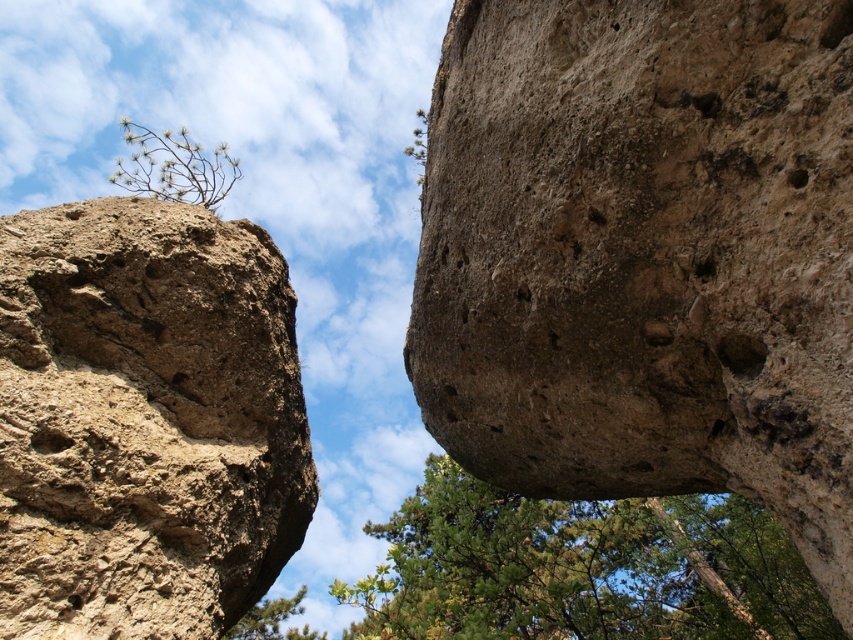
You are standing at the camera position and want to take a photo of the green leafy tree at upper left. The camera has a maximum focus range of 5 meters. Will the tree be in focus?

The green leafy tree at upper left is 5.84 meters away from camera, which exceeds the camera maximum focus range of 5 meters. Therefore, the tree will not be in focus.

Consider the image. You are standing in the natural scene and want to place a small flag at the highest point between the brown rough rock at upper left and the green leafy tree at center. Which object should you choose?

The brown rough rock at upper left is located above the green leafy tree at center, so you should place the flag on the brown rough rock at upper left as it is higher.

You are standing in the natural scene and want to take a photo of both the green leafy tree at upper left and the green leafy tree at lower left. Which tree should you position yourself to the right of to include both in your shot?

You should position yourself to the right of the green leafy tree at lower left because the green leafy tree at upper left is to the left of it, so positioning yourself to the right of the lower left tree will allow both trees to be captured in the photo.